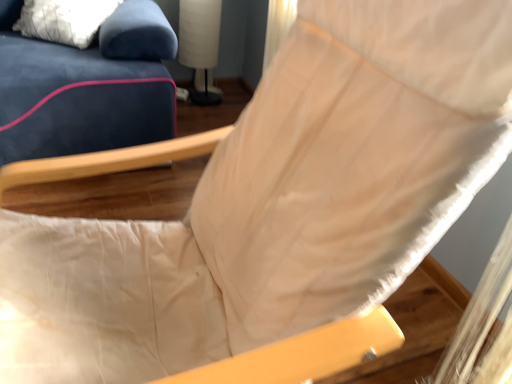
Question: Should I look upward or downward to see white fabric lampshade at upper center?

Choices:
 (A) down
 (B) up

Answer: (B)

Question: Is white fabric lampshade at upper center surrounding white textured pillow at upper left?

Choices:
 (A) no
 (B) yes

Answer: (A)

Question: Considering the relative positions of white fabric lampshade at upper center and white textured pillow at upper left in the image provided, is white fabric lampshade at upper center to the right of white textured pillow at upper left from the viewer's perspective?

Choices:
 (A) yes
 (B) no

Answer: (A)

Question: Is white fabric lampshade at upper center taller than white textured pillow at upper left?

Choices:
 (A) yes
 (B) no

Answer: (A)

Question: From the image's perspective, is white fabric lampshade at upper center on top of white textured pillow at upper left?

Choices:
 (A) no
 (B) yes

Answer: (B)

Question: From a real-world perspective, is white fabric lampshade at upper center physically above white textured pillow at upper left?

Choices:
 (A) yes
 (B) no

Answer: (B)

Question: Is white fabric lampshade at upper center shorter than white textured pillow at upper left?

Choices:
 (A) no
 (B) yes

Answer: (A)

Question: Would you say white textured pillow at upper left contains white fabric lampshade at upper center?

Choices:
 (A) yes
 (B) no

Answer: (B)

Question: From a real-world perspective, is white textured pillow at upper left beneath white fabric lampshade at upper center?

Choices:
 (A) yes
 (B) no

Answer: (B)

Question: Can you confirm if white textured pillow at upper left is bigger than white fabric lampshade at upper center?

Choices:
 (A) yes
 (B) no

Answer: (A)

Question: Can you confirm if white textured pillow at upper left is shorter than white fabric lampshade at upper center?

Choices:
 (A) no
 (B) yes

Answer: (B)

Question: From the image's perspective, would you say white textured pillow at upper left is shown under white fabric lampshade at upper center?

Choices:
 (A) yes
 (B) no

Answer: (A)

Question: From a real-world perspective, is white textured pillow at upper left located higher than white fabric lampshade at upper center?

Choices:
 (A) no
 (B) yes

Answer: (B)

Question: Is white fabric lampshade at upper center wider or thinner than white textured pillow at upper left?

Choices:
 (A) thin
 (B) wide

Answer: (A)